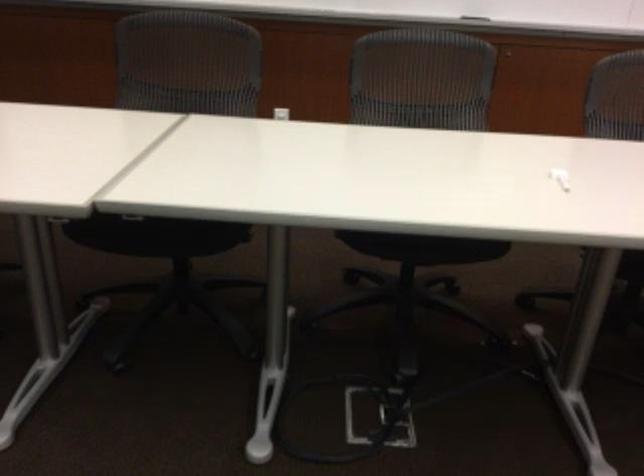
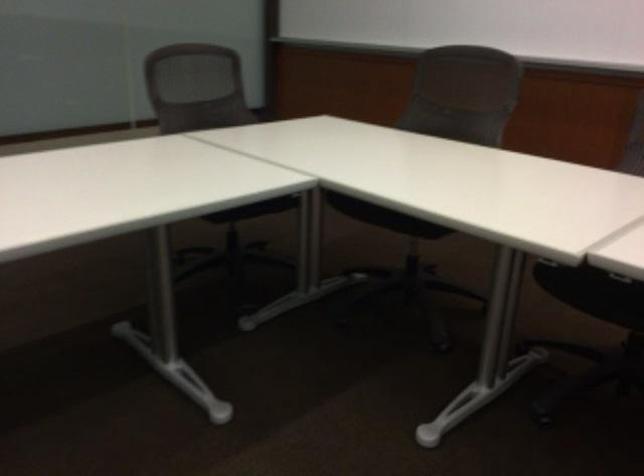
Question: How did the camera likely rotate?

Choices:
 (A) Left
 (B) Right
 (C) Up
 (D) Down

Answer: (A)